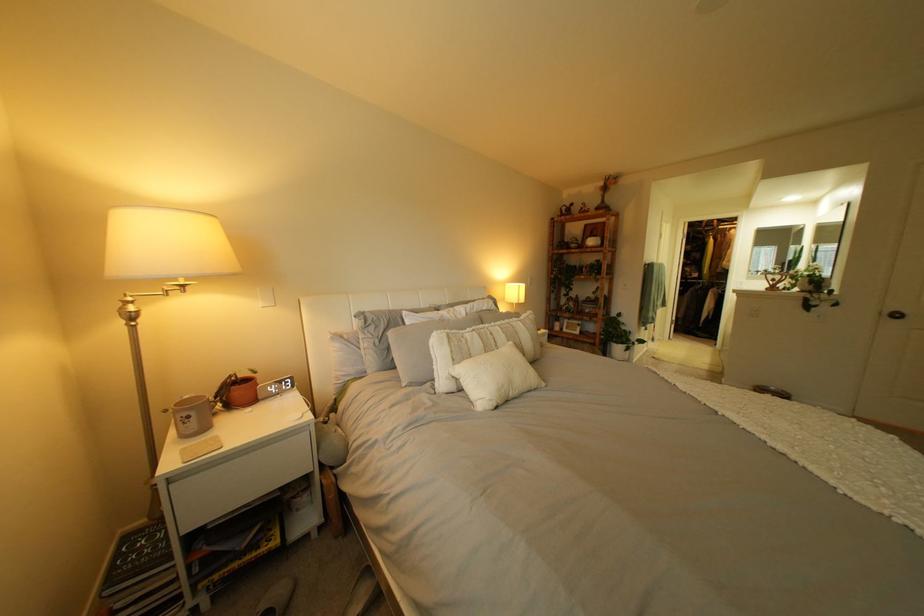
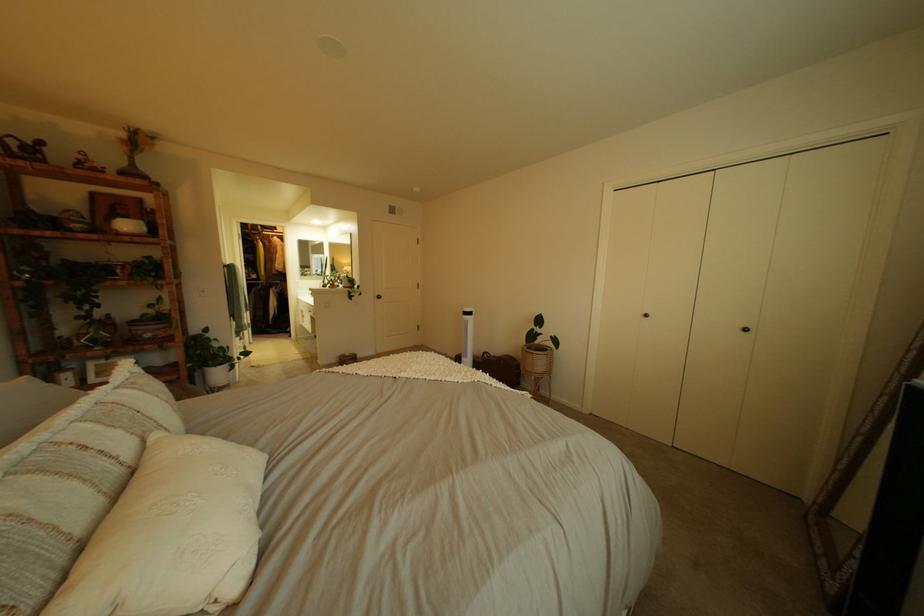
In the second image, find the point that corresponds to (731,223) in the first image.

(274, 228)